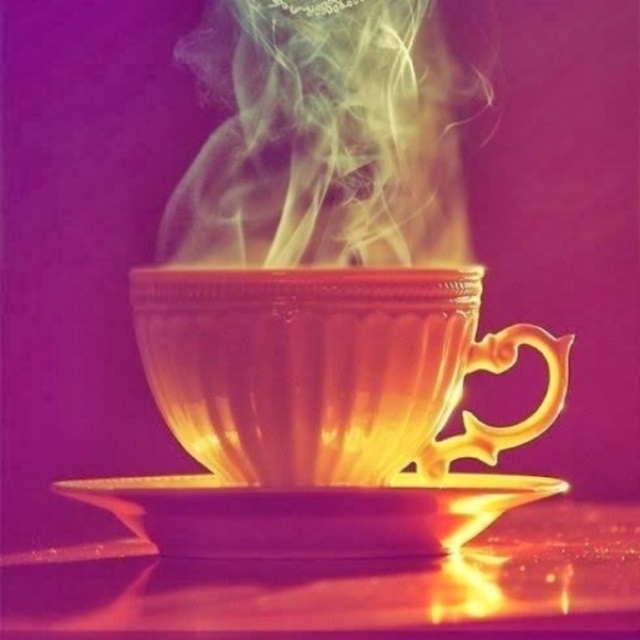
Is glossy reflective table at center wider than gold metallic saucer at center?

Indeed, glossy reflective table at center has a greater width compared to gold metallic saucer at center.

Which is more to the left, glossy reflective table at center or gold metallic saucer at center?

Positioned to the left is gold metallic saucer at center.

Who is more forward, (216,598) or (140,531)?

Point (216,598) is in front.

Identify the location of glossy reflective table at center. This screenshot has width=640, height=640. (355, 588).

Is translucent amber cup at center closer to the viewer compared to gold metallic saucer at center?

That is False.

Is translucent amber cup at center shorter than gold metallic saucer at center?

No, translucent amber cup at center is not shorter than gold metallic saucer at center.

Find the location of a particular element. This screenshot has height=640, width=640. translucent amber cup at center is located at coordinates (326, 369).

Does translucent amber cup at center appear under glossy reflective table at center?

No.

Who is more distant from viewer, (292,310) or (72,624)?

The point (292,310) is behind.

Between point (356, 385) and point (372, 566), which one is positioned in front?

Point (372, 566) is more forward.

Where is `translucent amber cup at center`? translucent amber cup at center is located at coordinates (326, 369).